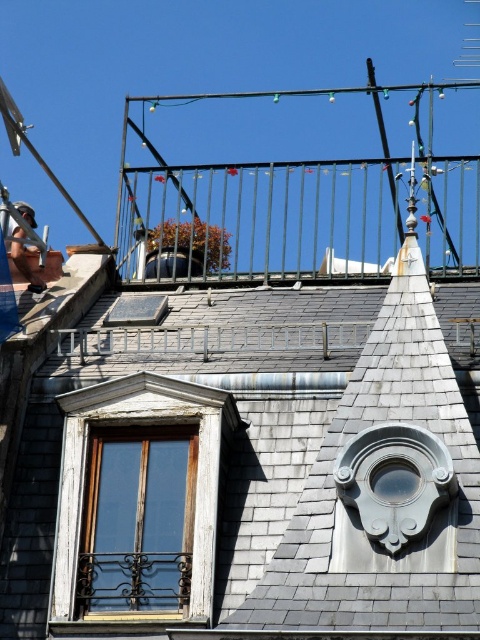
You are standing on the roof and looking at the wooden window at center. There is a point marked at coordinates (139,504). Is this point located on the wooden window at center?

Yes, the point (139,504) is on the wooden window at center.

You are standing on the roof and looking at the metallic black balcony at upper center. What are the coordinates of the balcony?

The coordinates of the metallic black balcony at upper center are at point [267,216].

You are planning to hang a large decorative wreath that requires 1.5 meters of space. You see the metallic black balcony at upper center and the wooden window at lower left. Which location has enough space to accommodate the wreath?

The metallic black balcony at upper center has a larger size compared to the wooden window at lower left, so it can accommodate the wreath requiring 1.5 meters of space.